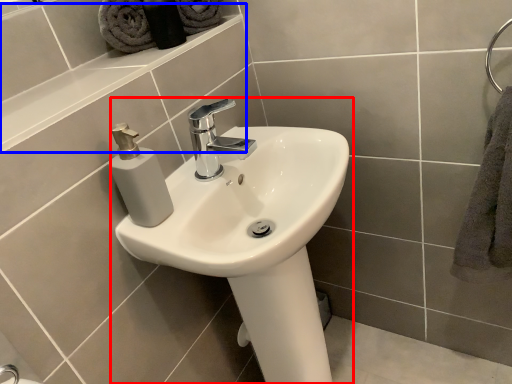
Question: Which of the following is the closest to the observer, sink (highlighted by a red box) or ledge (highlighted by a blue box)?

Choices:
 (A) sink
 (B) ledge

Answer: (A)